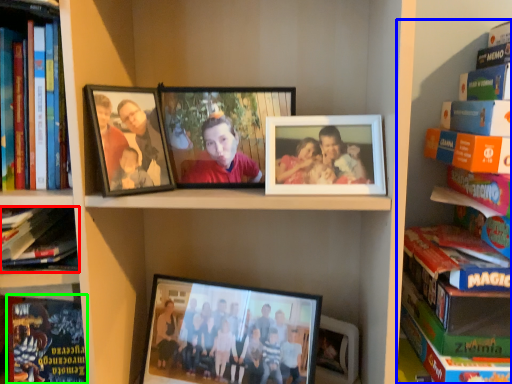
Question: Which object is the closest to the book (highlighted by a red box)? Choose among these: book (highlighted by a blue box) or paperback book (highlighted by a green box).

Choices:
 (A) book
 (B) paperback book

Answer: (B)